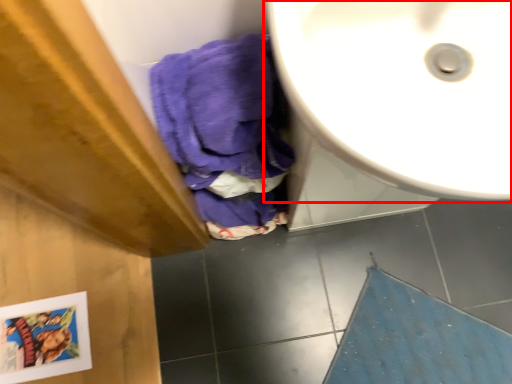
Question: From the image's perspective, where is sink (annotated by the red box) located relative to bath mat?

Choices:
 (A) above
 (B) below

Answer: (A)